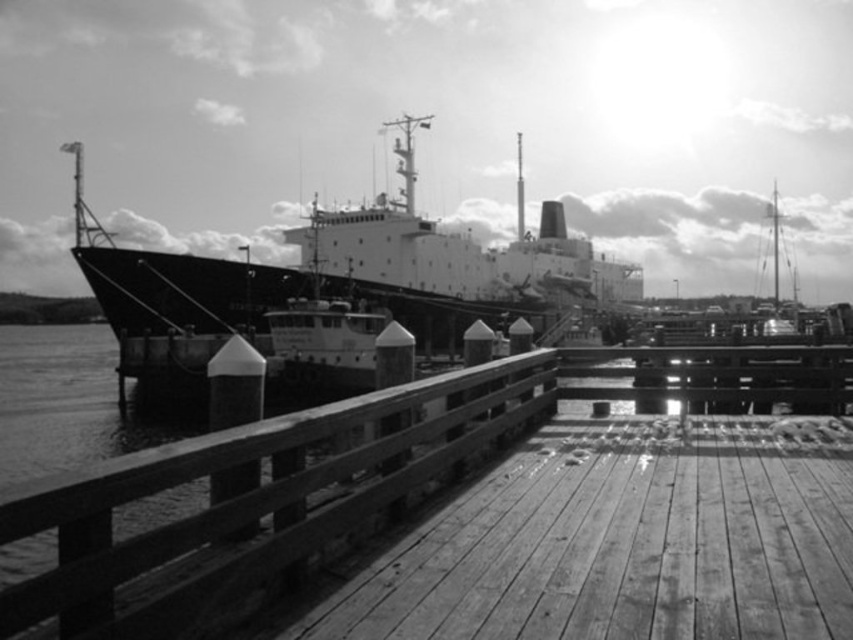
Which is more to the right, wooden at center or smooth black cargo ship at center?

From the viewer's perspective, smooth black cargo ship at center appears more on the right side.

Does point (273, 541) lie in front of point (432, 291)?

Yes, point (273, 541) is closer to viewer.

Between point (74, 627) and point (329, 392), which one is positioned in front?

Point (74, 627) is more forward.

Locate an element on the screen. The height and width of the screenshot is (640, 853). wooden at center is located at coordinates (251, 500).